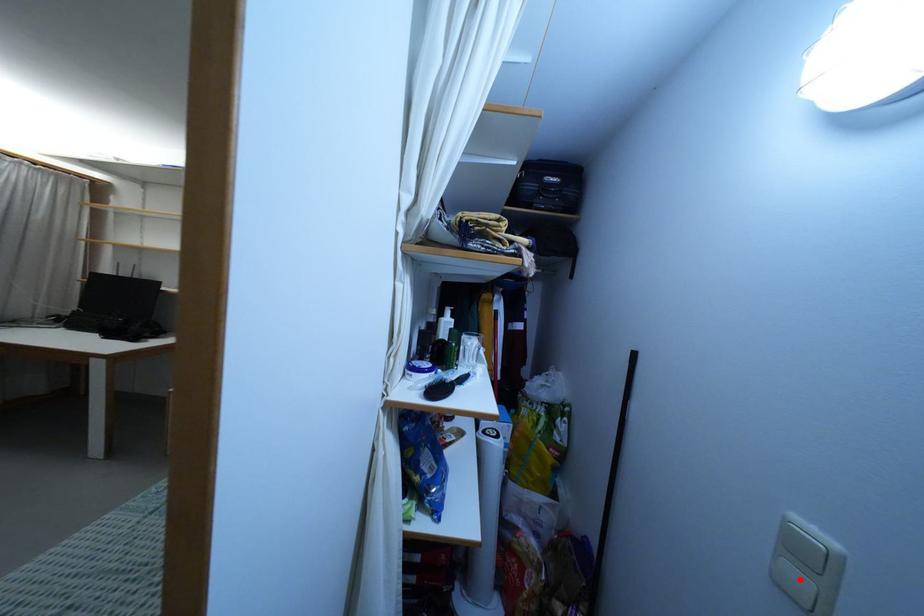
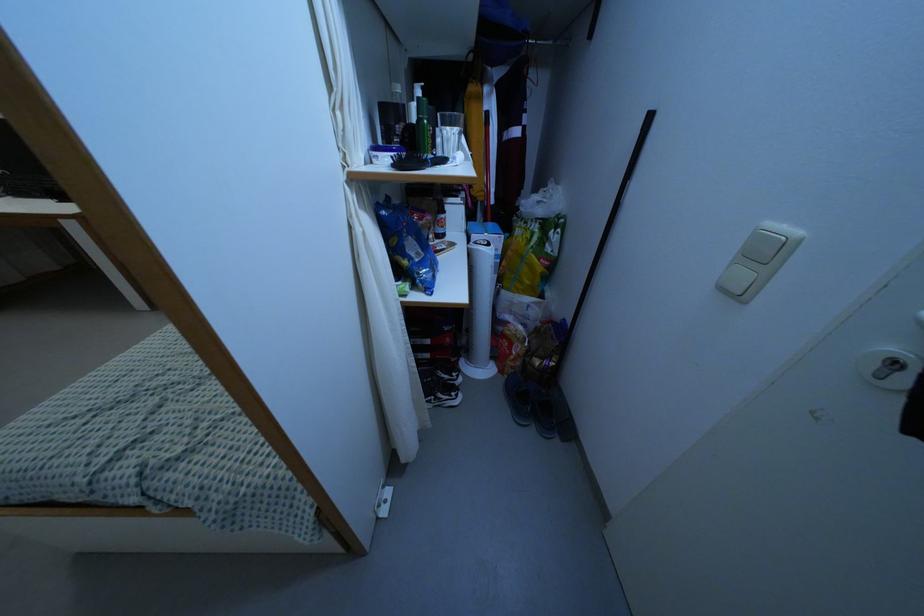
Question: I am providing you with two images of the same scene from different viewpoints. A red point is marked on the first image. Is the red point's position out of view in image 2?

Choices:
 (A) Yes
 (B) No

Answer: (B)